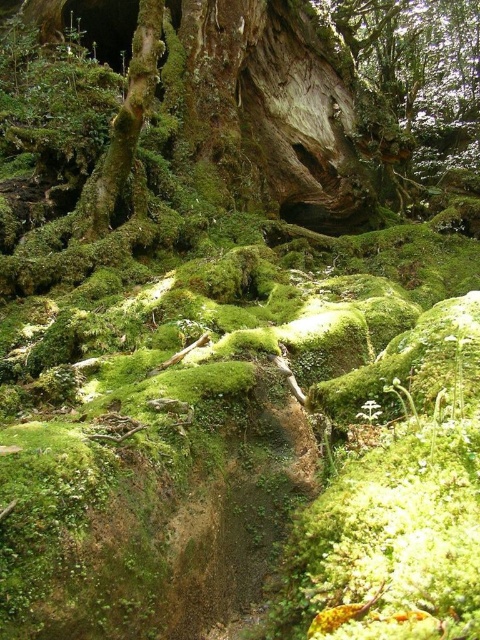
You are a hiker walking along the path in the forest scene. You see the rough bark tree trunk at center and the green mossy tree trunk at upper left. Which tree trunk is located to the right when facing the scene?

The rough bark tree trunk at center is positioned on the right side of green mossy tree trunk at upper left, so it is located to the right when facing the scene.

In the scene shown: You are standing in the forest and want to walk from point A to point B. Point A is at coordinate (348,198) and point B is at coordinate (95,189). According to the image, which point is closer to you so you can start walking towards it first?

Point B at (95,189) is closer to you, so you should start walking towards it first since it is nearer than point A at (348,198).

You are a hiker navigating through the forest and need to locate the rough bark tree trunk at center. What are the coordinates where you can find it?

The rough bark tree trunk at center is located at coordinates point (269, 116).